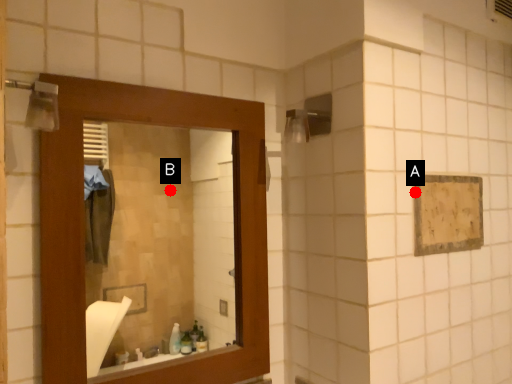
Question: Two points are circled on the image, labeled by A and B beside each circle. Which point is closer to the camera?

Choices:
 (A) A is closer
 (B) B is closer

Answer: (A)